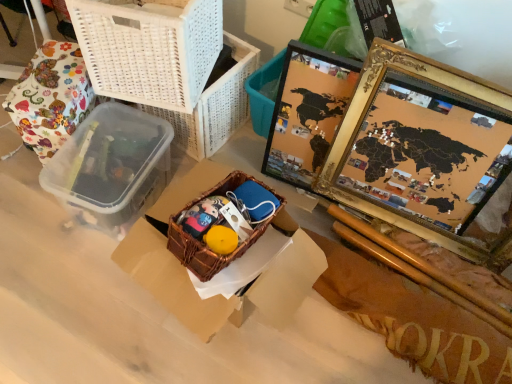
Locate an element on the screen. The height and width of the screenshot is (384, 512). vacant space that is to the left of transparent plastic lunch box at left is located at coordinates (29, 205).